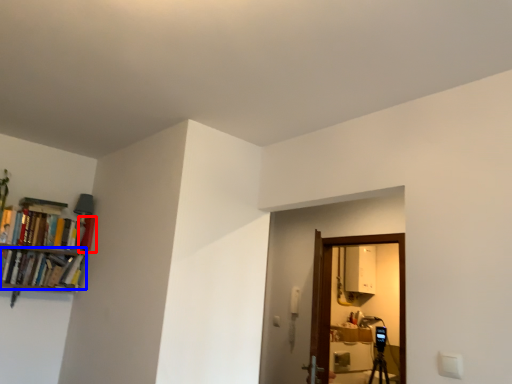
Question: Which object is closer to the camera taking this photo, book (highlighted by a red box) or book (highlighted by a blue box)?

Choices:
 (A) book
 (B) book

Answer: (B)